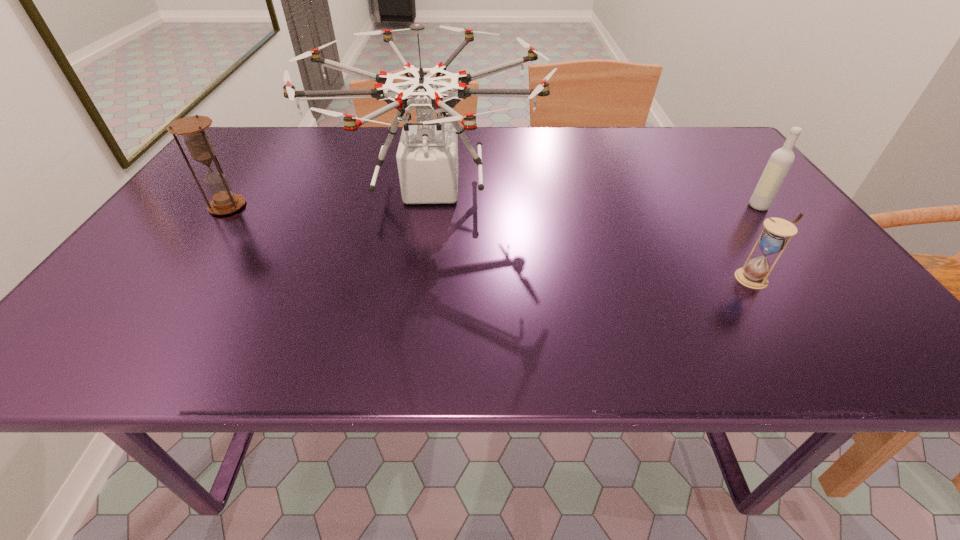
Identify the location of free space between the taller hourglass and the rightmost object. The height and width of the screenshot is (540, 960). (492, 206).

Where is `vacant area that lies between the right hourglass and the tallest object`? vacant area that lies between the right hourglass and the tallest object is located at coordinates (592, 233).

Where is `free area in between the tallest object and the taller hourglass`? The image size is (960, 540). free area in between the tallest object and the taller hourglass is located at coordinates (329, 198).

I want to click on vacant space in between the nearer hourglass and the tallest object, so click(x=592, y=233).

Image resolution: width=960 pixels, height=540 pixels. Identify the location of vacant space that is in between the rightmost object and the taller hourglass. (492, 206).

This screenshot has height=540, width=960. In order to click on vacant area that lies between the tallest object and the rightmost object in this screenshot , I will do `click(595, 197)`.

Image resolution: width=960 pixels, height=540 pixels. Find the location of `free spot between the nearest object and the leftmost object`. free spot between the nearest object and the leftmost object is located at coordinates (491, 242).

Identify the location of free space between the leftmost object and the tallest object. pyautogui.click(x=329, y=198).

Locate which object ranks second in proximity to the farther hourglass. Please provide its 2D coordinates. Your answer should be formatted as a tuple, i.e. [(x, y)], where the tuple contains the x and y coordinates of a point satisfying the conditions above.

[(774, 238)]

Identify which object is the second nearest to the left hourglass. Please provide its 2D coordinates. Your answer should be formatted as a tuple, i.e. [(x, y)], where the tuple contains the x and y coordinates of a point satisfying the conditions above.

[(774, 238)]